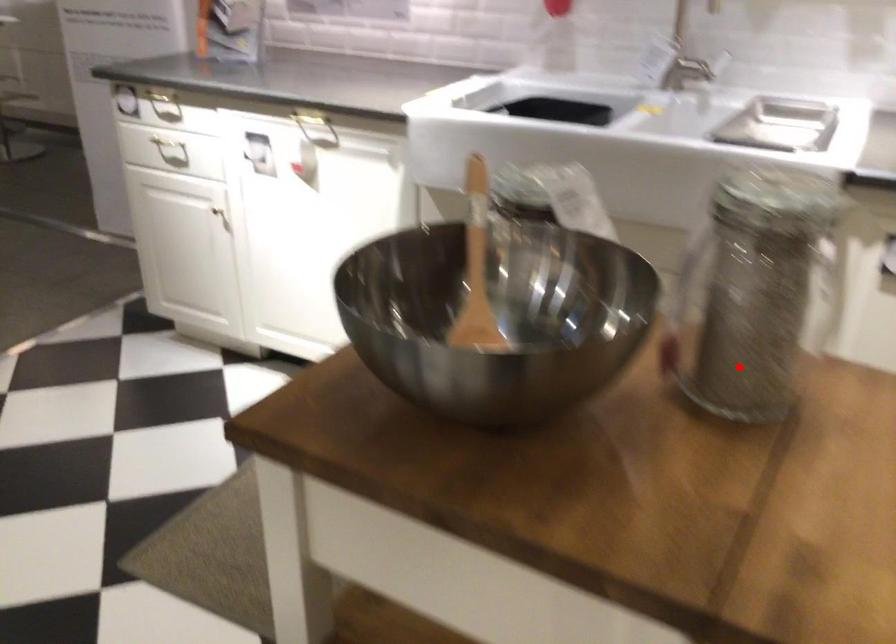
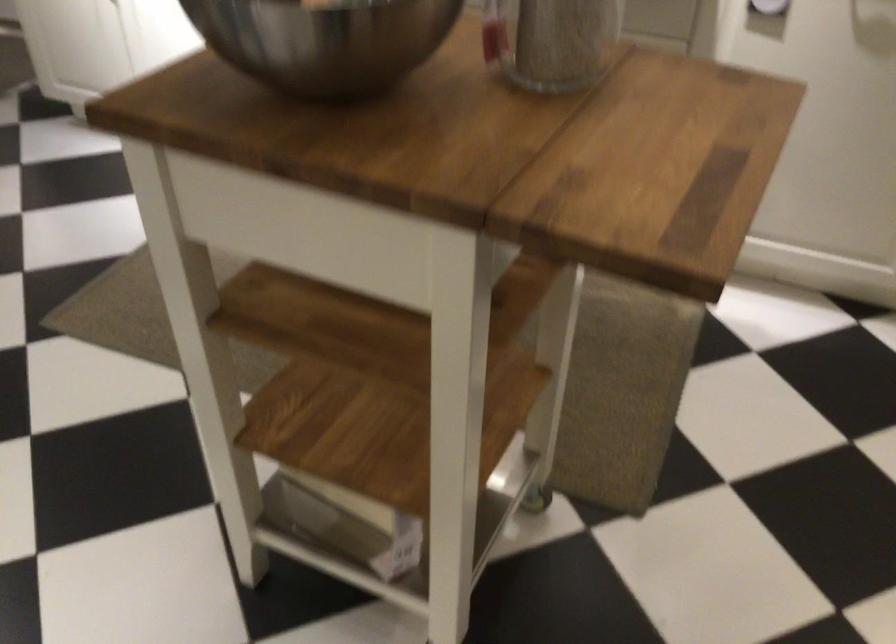
In the second image, find the point that corresponds to the highlighted location in the first image.

(553, 41)